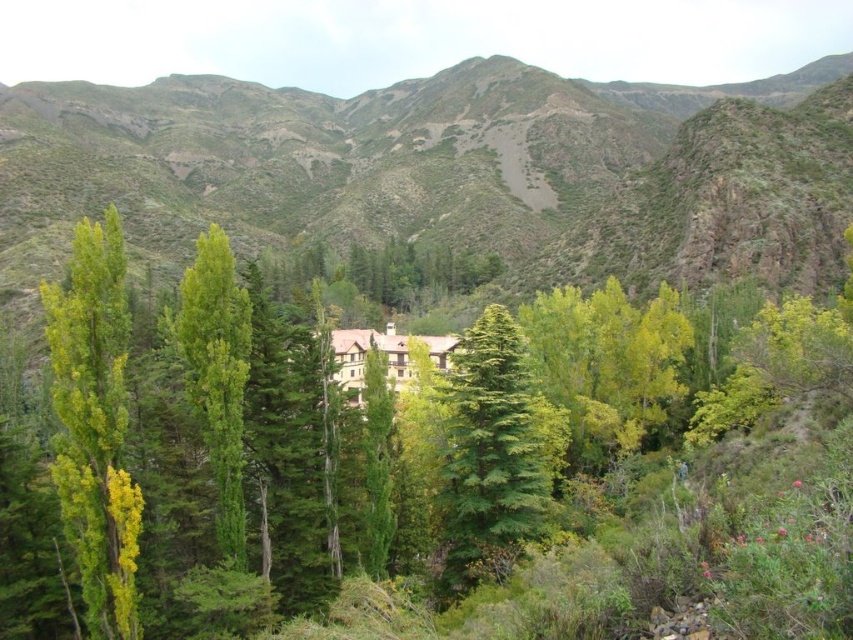
Which is behind, point (534, 520) or point (57, 404)?

Point (534, 520)

Does point (624, 595) come in front of point (68, 449)?

Yes, point (624, 595) is in front of point (68, 449).

Locate an element on the screen. This screenshot has height=640, width=853. green matte tree at center is located at coordinates (515, 417).

Is green grassy mountain at center wider than green textured tree at center?

Yes, green grassy mountain at center is wider than green textured tree at center.

Can you confirm if green grassy mountain at center is taller than green textured tree at center?

Correct, green grassy mountain at center is much taller as green textured tree at center.

Which is behind, point (543, 234) or point (451, 522)?

Positioned behind is point (543, 234).

You are a GUI agent. You are given a task and a screenshot of the screen. Output one action in this format:
    pyautogui.click(x=<x>, y=<y>)
    Task: Click on the green grassy mountain at center
    The height and width of the screenshot is (640, 853).
    Given the screenshot: What is the action you would take?
    pyautogui.click(x=334, y=157)

Is green textured tree at center bigger than green leafy tree at left?

No, green textured tree at center is not bigger than green leafy tree at left.

Who is higher up, green textured tree at center or green leafy tree at left?

Positioned higher is green leafy tree at left.

This screenshot has width=853, height=640. In order to click on green textured tree at center in this screenshot , I will do `click(492, 454)`.